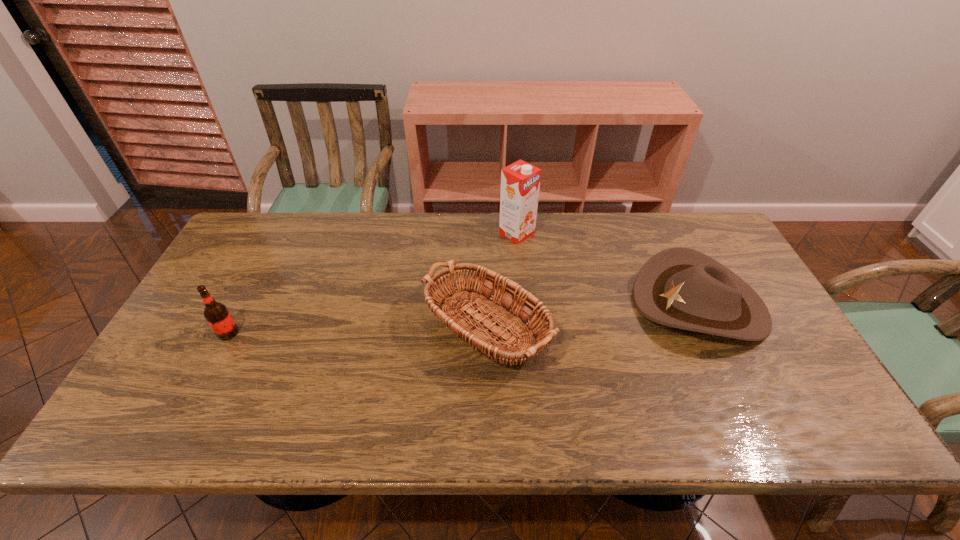
Where is `vacant position in the image that satisfies the following two spatial constraints: 1. with a star on the front of the rightmost object; 2. on the front side of the root beer`? The height and width of the screenshot is (540, 960). vacant position in the image that satisfies the following two spatial constraints: 1. with a star on the front of the rightmost object; 2. on the front side of the root beer is located at coordinates (713, 333).

Where is `vacant region that satisfies the following two spatial constraints: 1. with a star on the front of the shortest object; 2. on the front side of the root beer`? This screenshot has height=540, width=960. vacant region that satisfies the following two spatial constraints: 1. with a star on the front of the shortest object; 2. on the front side of the root beer is located at coordinates (713, 333).